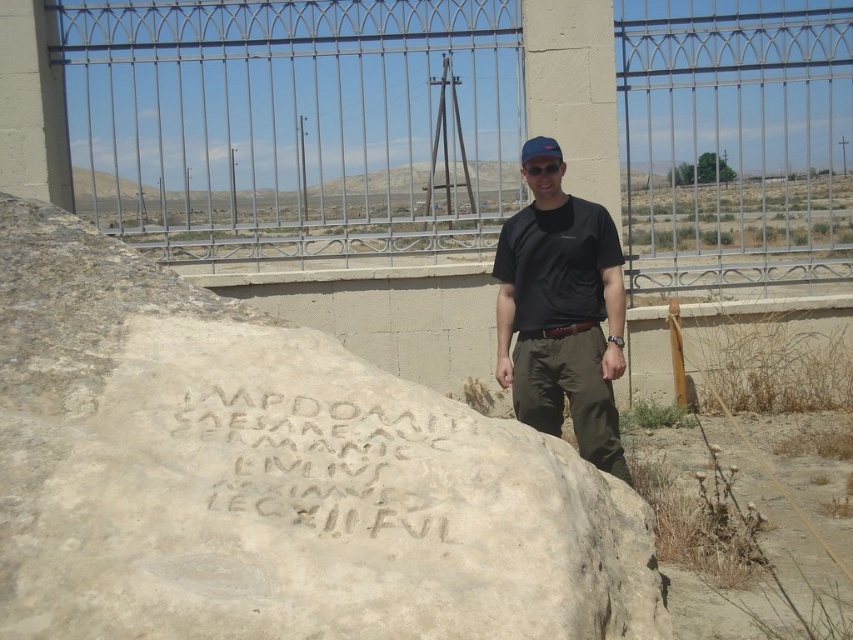
You are a photographer setting up for a portrait. You have a light beige stone boulder at center and a black matte shirt at center in your frame. Which object should you focus on first if you want to capture the larger subject in your shot?

The light beige stone boulder at center is larger in size than the black matte shirt at center, so you should focus on the light beige stone boulder at center first to capture the larger subject.

You are a photographer trying to capture the light beige stone boulder at center and the brushed metal fence at upper center in the same frame. Based on their sizes, which object will appear larger in the photo?

The light beige stone boulder at center will appear larger in the photo because it is much taller than the brushed metal fence at upper center.